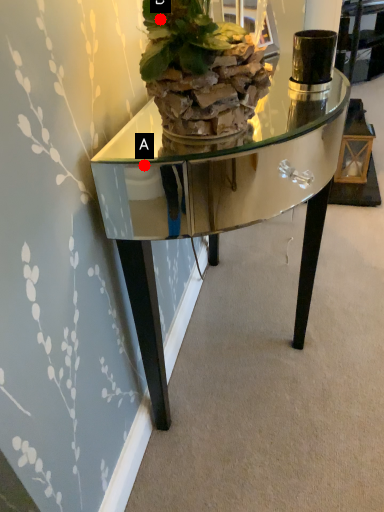
Question: Two points are circled on the image, labeled by A and B beside each circle. Among these points, which one is nearest to the camera?

Choices:
 (A) A is closer
 (B) B is closer

Answer: (B)